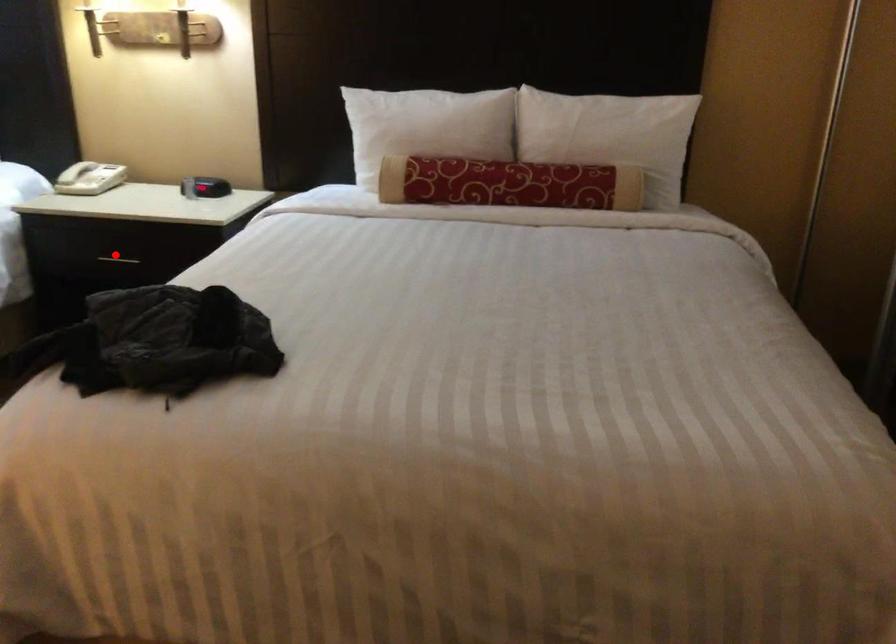
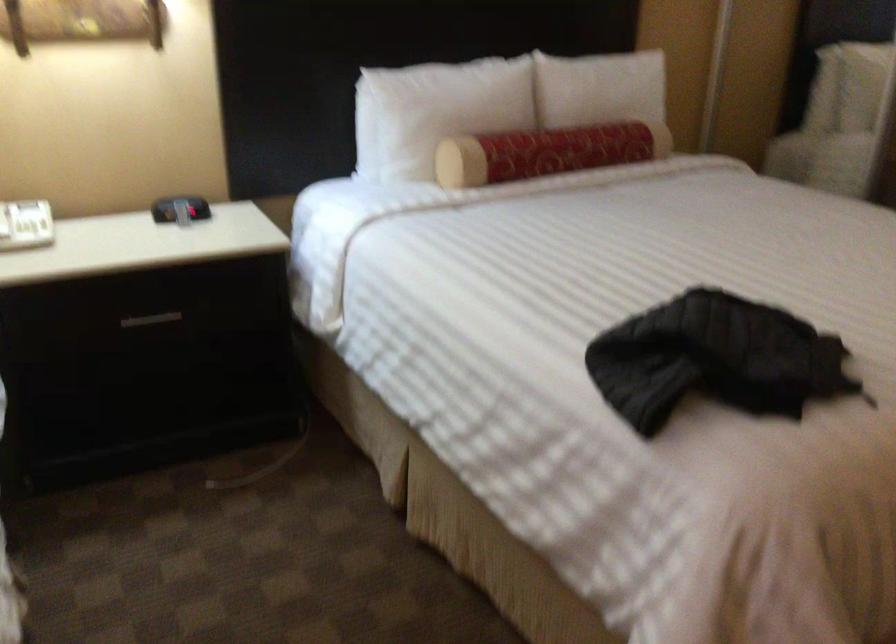
Question: A red point is marked in image1. In image2, is the corresponding 3D point closer to the camera or farther? Reply with the corresponding letter.

Choices:
 (A) The corresponding 3D point is closer.
 (B) The corresponding 3D point is farther.

Answer: (A)